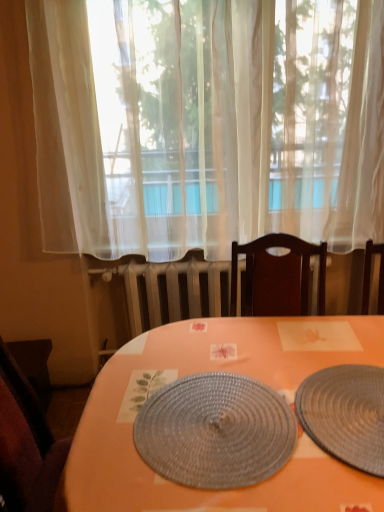
Locate an element on the screen. blank space above woven gray placemat at center, which is counted as the 1th plate, starting from the left (from a real-world perspective) is located at coordinates (214, 424).